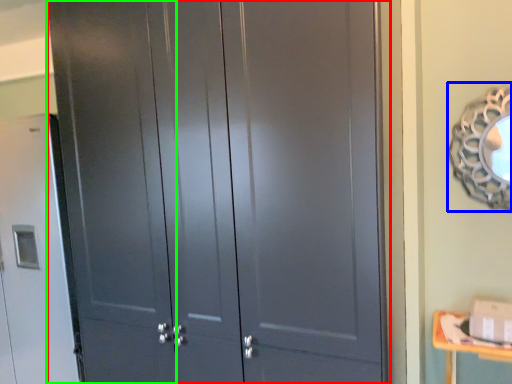
Question: Which object is the farthest from door (highlighted by a red box)? Choose among these: mirror (highlighted by a blue box) or screen door (highlighted by a green box).

Choices:
 (A) mirror
 (B) screen door

Answer: (A)